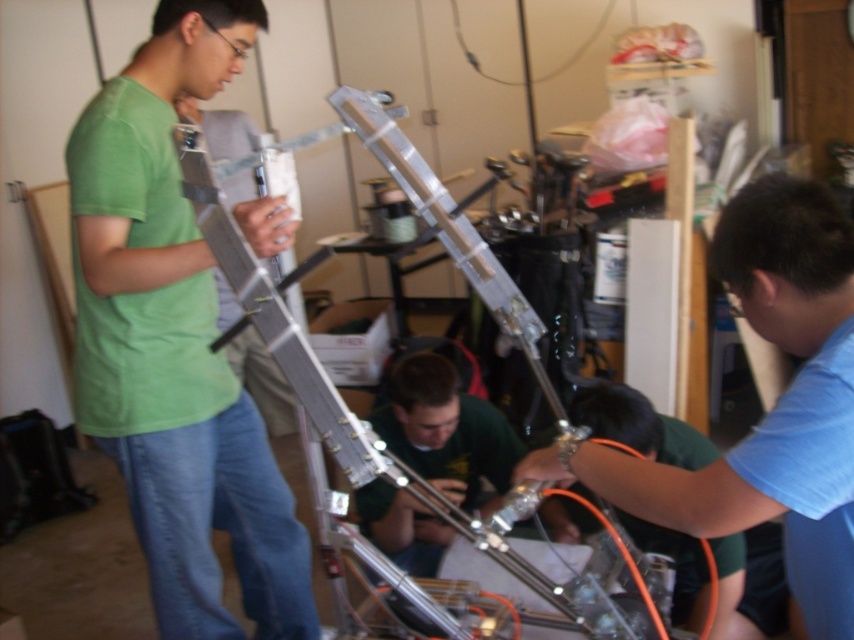
You are a photographer standing in the room and want to take a photo of the blue matte shirt at lower right and the green fabric shirt at center. Which person should you focus on first if you want to capture both in the same frame without moving the camera?

The blue matte shirt at lower right is taller than the green fabric shirt at center, so you should focus on the blue matte shirt at lower right first to ensure both are in frame.

You are standing in the room where the mechanical project is being worked on. You need to locate the blue matte shirt at lower right. According to the coordinates provided, where exactly is it positioned?

The blue matte shirt at lower right is positioned at coordinates point (771, 408).

Consider the image. You are a photographer trying to capture a group photo of the blue matte shirt at lower right and the green fabric shirt at center. Given their sizes, which one should you focus on to ensure both fit comfortably in the frame without cropping?

The blue matte shirt at lower right is smaller in size compared to the green fabric shirt at center. To ensure both fit comfortably in the frame without cropping, focus on the larger green fabric shirt at center and adjust the camera angle to include the smaller blue matte shirt at lower right.